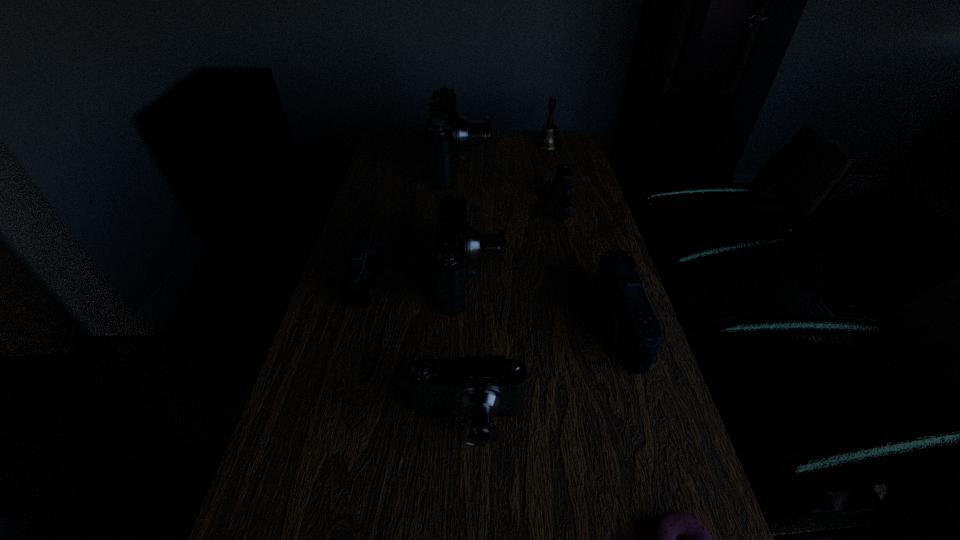
Where is `object situated at the far right corner`? The image size is (960, 540). object situated at the far right corner is located at coordinates (548, 140).

This screenshot has height=540, width=960. In the image, there is a desktop. Find the location of `vacant space at the left edge`. vacant space at the left edge is located at coordinates (316, 335).

This screenshot has width=960, height=540. Identify the location of free space at the right edge of the desktop. (585, 325).

Locate an element on the screen. The image size is (960, 540). vacant space at the far left corner is located at coordinates [x=414, y=146].

The height and width of the screenshot is (540, 960). Find the location of `vacant space that is in between the farthest camcorder and the second farthest blue camcorder`. vacant space that is in between the farthest camcorder and the second farthest blue camcorder is located at coordinates (468, 219).

Where is `vacant area that lies between the fourth shortest camcorder and the bigger black camcorder`? Image resolution: width=960 pixels, height=540 pixels. vacant area that lies between the fourth shortest camcorder and the bigger black camcorder is located at coordinates (544, 300).

The height and width of the screenshot is (540, 960). In order to click on free space between the brown headset and the nearest camcorder in this screenshot , I will do `click(514, 316)`.

Where is `vacant area between the second biggest blue camcorder and the bigger black camcorder`? The width and height of the screenshot is (960, 540). vacant area between the second biggest blue camcorder and the bigger black camcorder is located at coordinates (544, 300).

Locate an element on the screen. Image resolution: width=960 pixels, height=540 pixels. free space between the nearest camcorder and the leftmost camcorder is located at coordinates click(418, 351).

Locate an element on the screen. The width and height of the screenshot is (960, 540). unoccupied position between the bell and the headset is located at coordinates (553, 178).